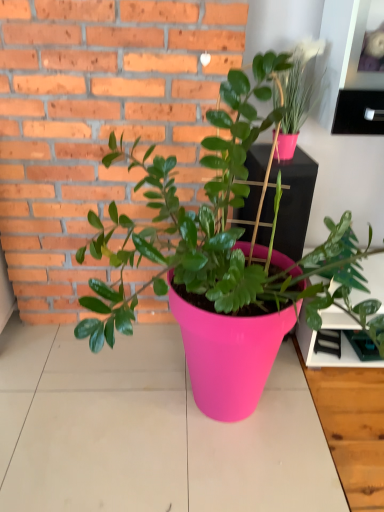
Question: From a real-world perspective, is matte pink pot at upper right, which is counted as the first houseplant, starting from the right, positioned above or below pink plastic shelf at upper right?

Choices:
 (A) above
 (B) below

Answer: (A)

Question: Relative to pink plastic shelf at upper right, is matte pink pot at upper right, positioned as the 2th houseplant in left-to-right order, in front or behind?

Choices:
 (A) behind
 (B) front

Answer: (B)

Question: Which object is positioned farthest from the matte pink pot at upper right, positioned as the 2th houseplant in left-to-right order?

Choices:
 (A) pink plastic shelf at upper right
 (B) pink plastic table top at center
 (C) pink plastic pot at center, acting as the 2th houseplant starting from the right

Answer: (B)

Question: Which object is the closest to the matte pink pot at upper right, which is counted as the first houseplant, starting from the right?

Choices:
 (A) pink plastic pot at center, the 1th houseplant viewed from the left
 (B) pink plastic shelf at upper right
 (C) pink plastic table top at center

Answer: (B)